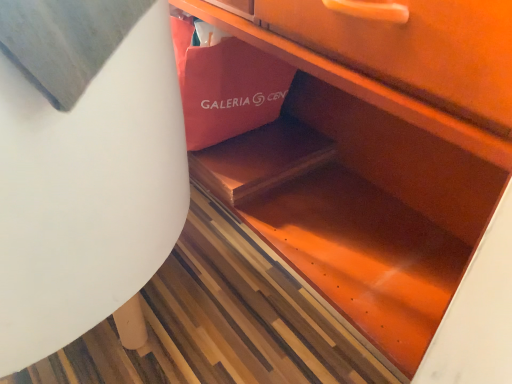
Question: Should I look upward or downward to see white matte round table at lower left?

Choices:
 (A) up
 (B) down

Answer: (A)

Question: Is white matte round table at lower left next to matte pink paper bag at center?

Choices:
 (A) yes
 (B) no

Answer: (B)

Question: Is white matte round table at lower left bigger than matte pink paper bag at center?

Choices:
 (A) no
 (B) yes

Answer: (B)

Question: Can you confirm if white matte round table at lower left is positioned to the right of matte pink paper bag at center?

Choices:
 (A) yes
 (B) no

Answer: (B)

Question: Is white matte round table at lower left positioned before matte pink paper bag at center?

Choices:
 (A) no
 (B) yes

Answer: (B)

Question: Is matte pink paper bag at center located within white matte round table at lower left?

Choices:
 (A) no
 (B) yes

Answer: (A)

Question: Is white matte round table at lower left shorter than matte pink paper bag at center?

Choices:
 (A) yes
 (B) no

Answer: (B)

Question: Does matte pink paper bag at center touch white matte round table at lower left?

Choices:
 (A) no
 (B) yes

Answer: (A)

Question: Does matte pink paper bag at center lie in front of white matte round table at lower left?

Choices:
 (A) no
 (B) yes

Answer: (A)

Question: From a real-world perspective, is matte pink paper bag at center located beneath white matte round table at lower left?

Choices:
 (A) no
 (B) yes

Answer: (B)

Question: Does matte pink paper bag at center have a greater width compared to white matte round table at lower left?

Choices:
 (A) yes
 (B) no

Answer: (B)

Question: Is white matte round table at lower left surrounded by matte pink paper bag at center?

Choices:
 (A) no
 (B) yes

Answer: (A)

Question: Does matte pink paper bag at center appear on the right side of white matte round table at lower left?

Choices:
 (A) yes
 (B) no

Answer: (A)

Question: From a real-world perspective, is matte pink paper bag at center above or below white matte round table at lower left?

Choices:
 (A) above
 (B) below

Answer: (B)